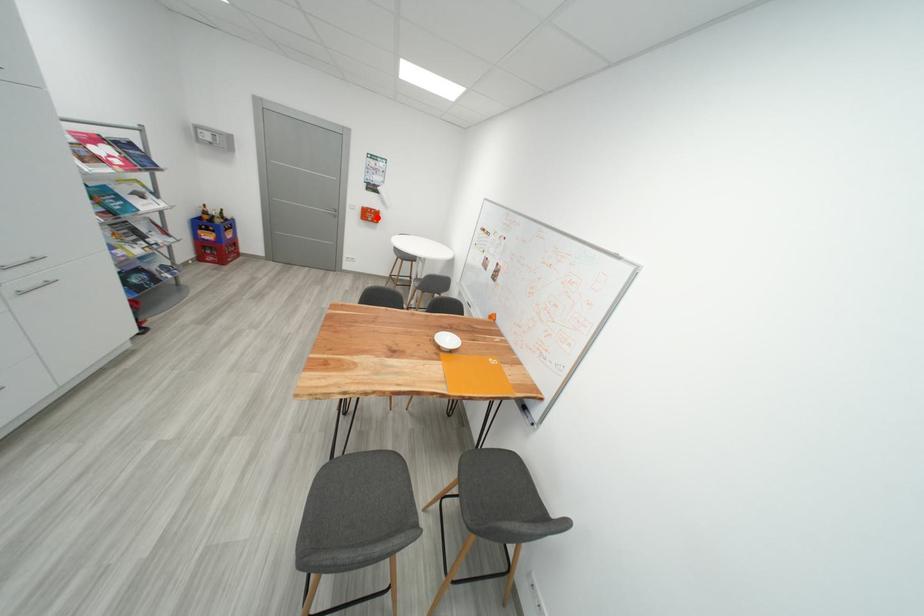
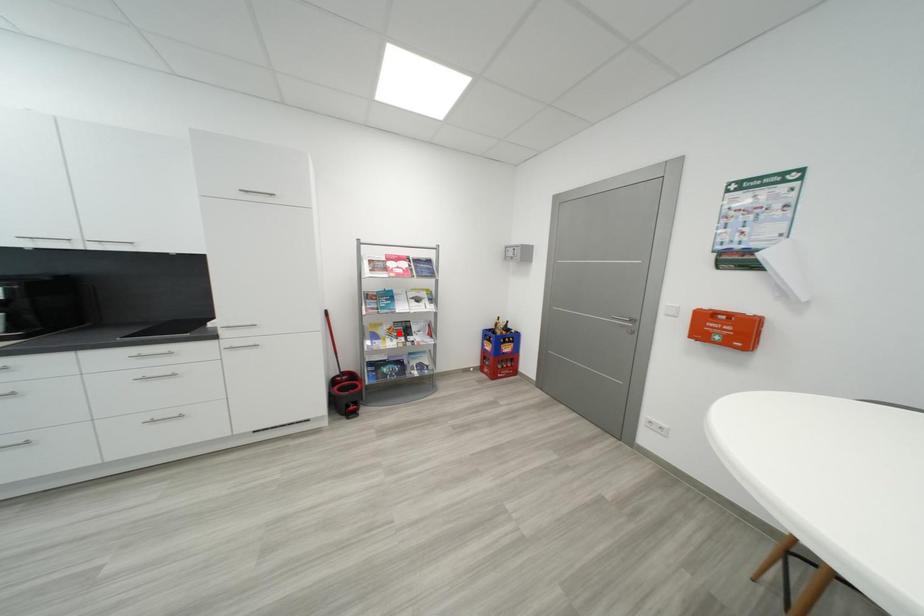
I am providing you with two images of the same scene from different viewpoints. A red point is marked on the first image and another point is marked on the second image. Is the red point in image1 aligned with the point shown in image2?

No